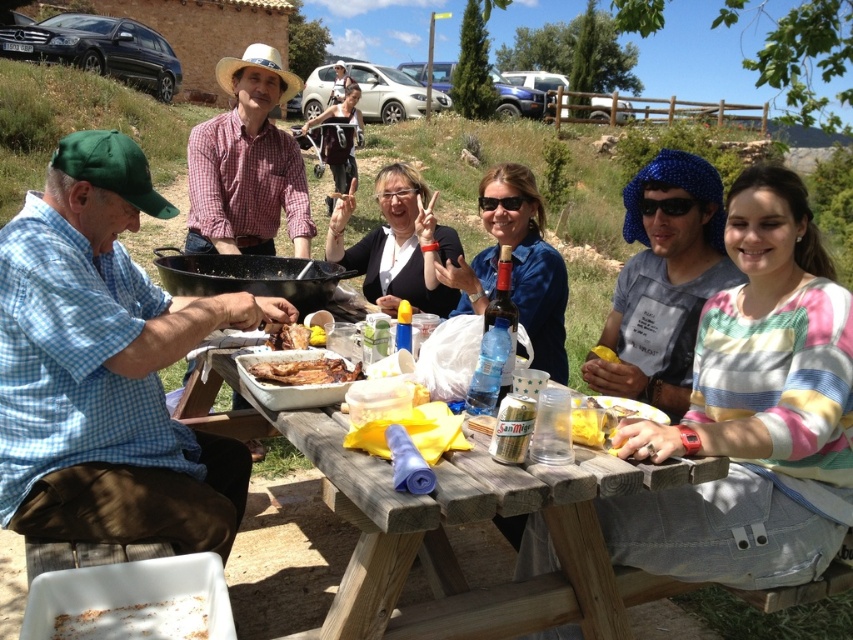
Is point (193, 616) positioned in front of point (315, 371)?

Yes, it is.

The width and height of the screenshot is (853, 640). What do you see at coordinates (138, 620) in the screenshot?
I see `white crumbly food at lower left` at bounding box center [138, 620].

Which is in front, point (61, 637) or point (360, 372)?

Positioned in front is point (61, 637).

Where is `white crumbly food at lower left`? white crumbly food at lower left is located at coordinates (138, 620).

From the picture: Is blue checkered shirt at left smaller than matte black sweater at center?

Indeed, blue checkered shirt at left has a smaller size compared to matte black sweater at center.

Does blue checkered shirt at left come behind matte black sweater at center?

No, blue checkered shirt at left is in front of matte black sweater at center.

The image size is (853, 640). I want to click on blue checkered shirt at left, so click(x=106, y=368).

Which is in front, point (648, 474) or point (323, 156)?

Point (648, 474)

I want to click on wooden picnic table at center, so click(x=451, y=522).